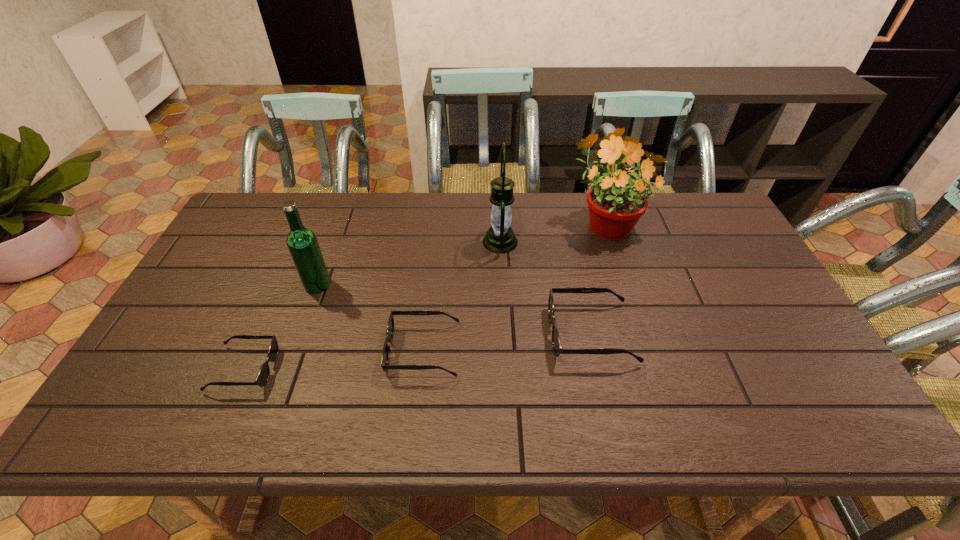
At what (x,y) coordinates should I click in order to perform the action: click on free location located on the side where the lantern emits light. Please return your answer as a coordinate pair (x, y). The height and width of the screenshot is (540, 960). Looking at the image, I should click on (381, 242).

This screenshot has width=960, height=540. What are the coordinates of `blank space located on the right of the fourth nearest object` in the screenshot? It's located at (397, 285).

At what (x,y) coordinates should I click in order to perform the action: click on flowerpot located in the far edge section of the desktop. Please return your answer as a coordinate pair (x, y). Looking at the image, I should click on (616, 202).

At what (x,y) coordinates should I click in order to perform the action: click on lantern positioned at the far edge. Please return your answer as a coordinate pair (x, y). The height and width of the screenshot is (540, 960). Looking at the image, I should click on (500, 238).

What are the coordinates of `free space at the far edge of the desktop` in the screenshot? It's located at (588, 227).

The width and height of the screenshot is (960, 540). What are the coordinates of `free space at the near edge` in the screenshot? It's located at (562, 381).

You are a GUI agent. You are given a task and a screenshot of the screen. Output one action in this format:
    pyautogui.click(x=<x>, y=<y>)
    Task: Click on the free region at the left edge of the desktop
    
    Given the screenshot: What is the action you would take?
    pyautogui.click(x=206, y=268)

Where is `vacant position at the right edge of the desktop`? vacant position at the right edge of the desktop is located at coordinates (769, 327).

Where is `free space at the far left corner`? Image resolution: width=960 pixels, height=540 pixels. free space at the far left corner is located at coordinates (275, 201).

Where is `free region at the near left corner`? free region at the near left corner is located at coordinates tap(188, 364).